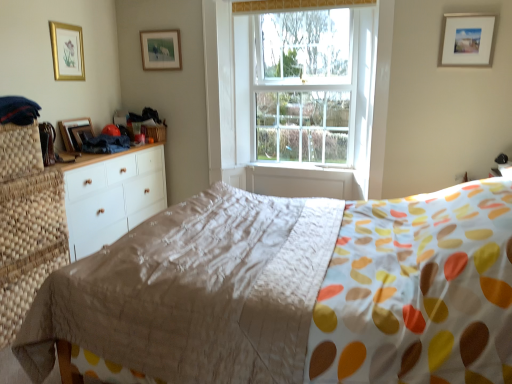
Find the location of a particular element. Image resolution: width=512 pixels, height=384 pixels. free space above clear glass window at center (from a real-world perspective) is located at coordinates (300, 11).